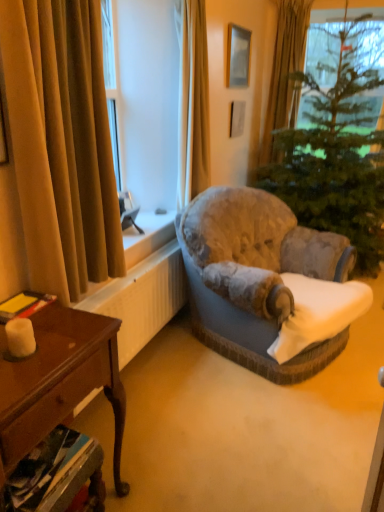
Find the location of a particular element. The width and height of the screenshot is (384, 512). vacant space to the right of white textured radiator at lower left is located at coordinates (216, 376).